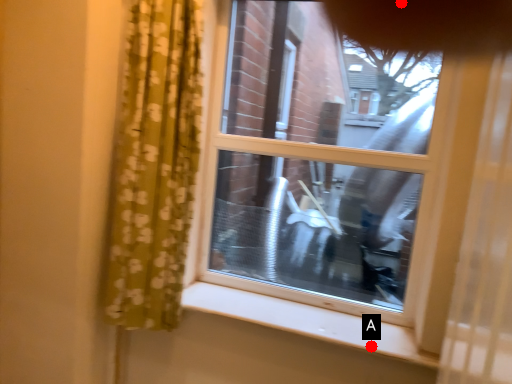
Question: Two points are circled on the image, labeled by A and B beside each circle. Among these points, which one is farthest from the camera?

Choices:
 (A) A is further
 (B) B is further

Answer: (B)